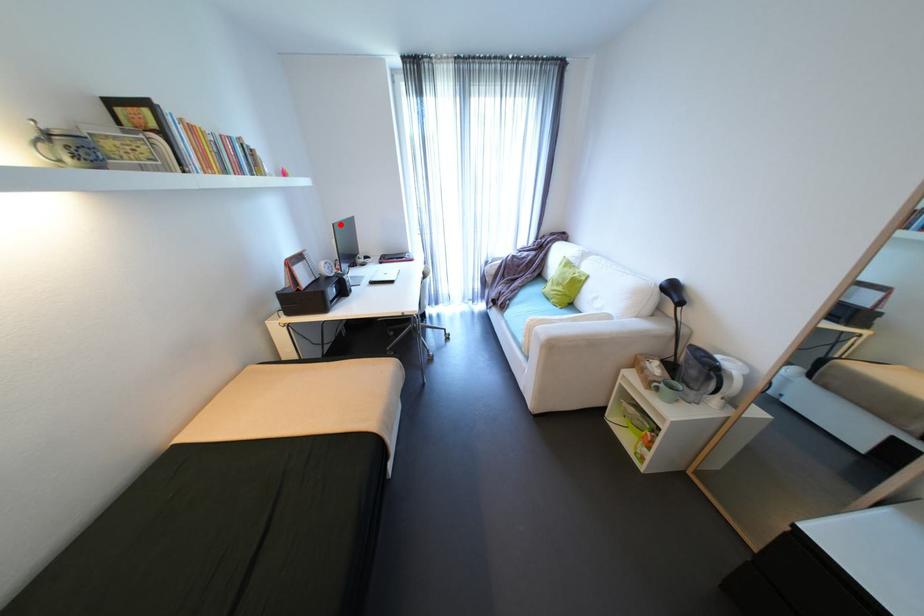
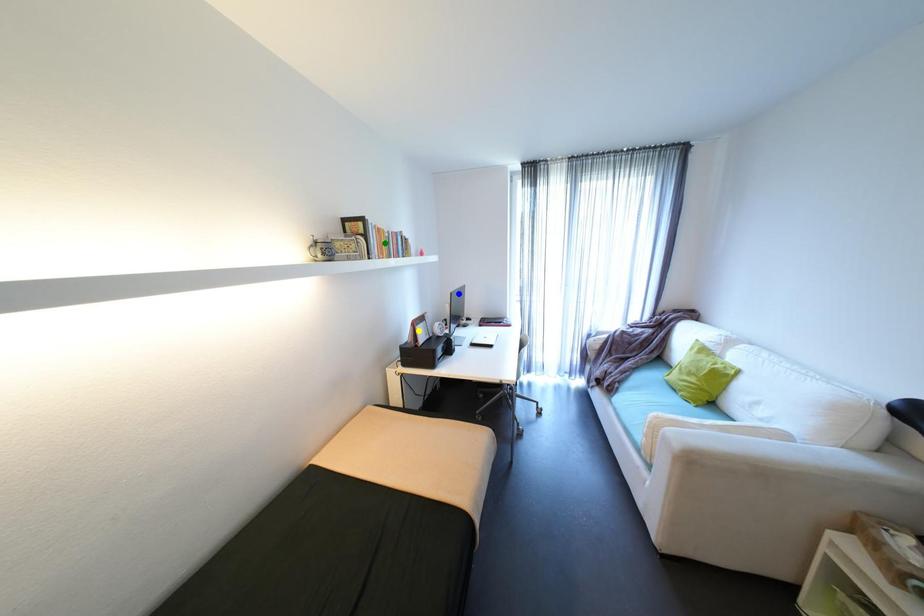
Question: I am providing you with two images of the same scene from different viewpoints. A red point is marked on the first image. You are given multiple points on the second image. Which point in image 2 is actually the same real-world point as the red point in image 1?

Choices:
 (A) blue point
 (B) yellow point
 (C) green point

Answer: (A)